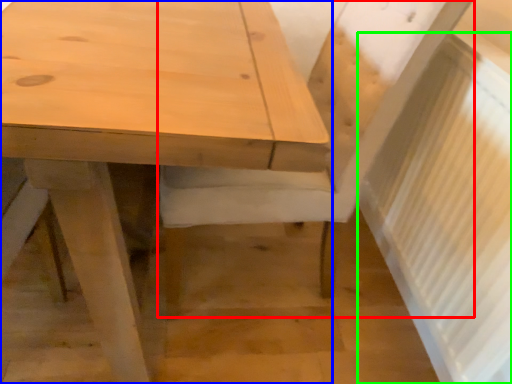
Question: Which object is positioned closest to chair (highlighted by a red box)? Select from table (highlighted by a blue box) and radiator (highlighted by a green box).

Choices:
 (A) table
 (B) radiator

Answer: (B)